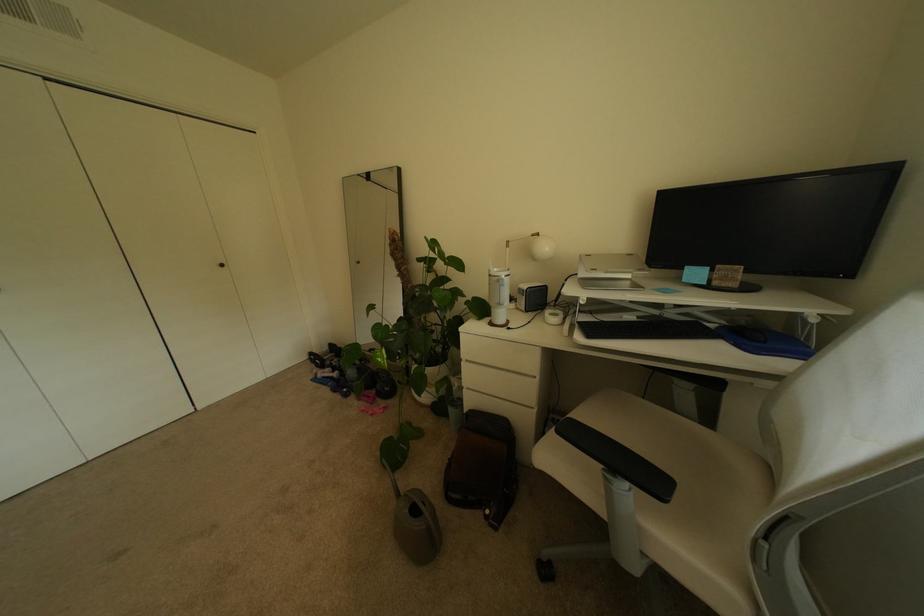
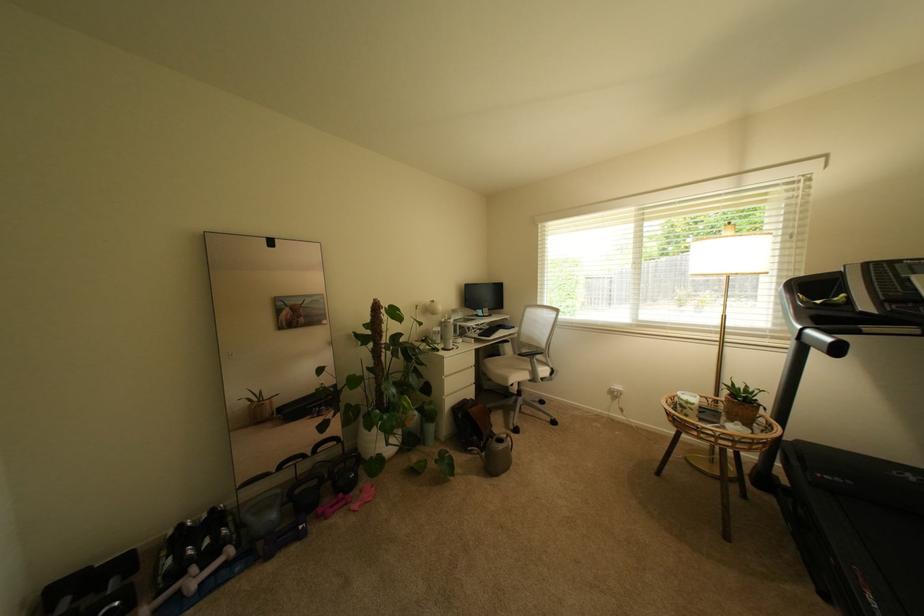
In the second image, find the point that corresponds to the point at 371,397 in the first image.

(339, 508)